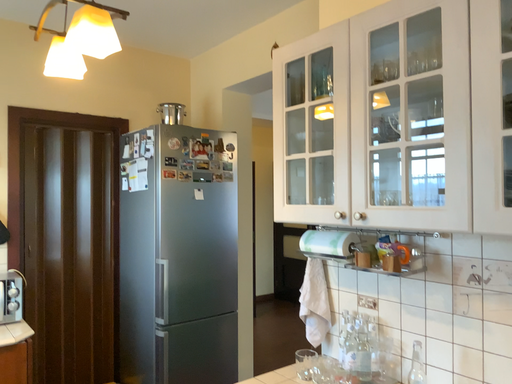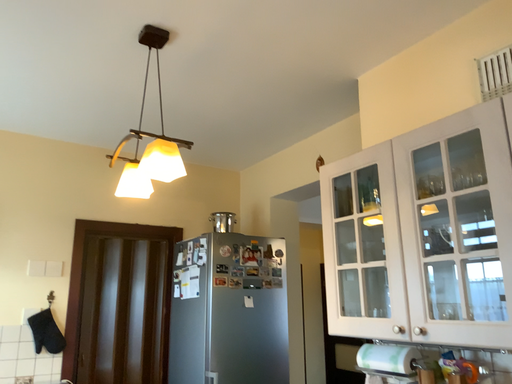
Question: How did the camera likely rotate when shooting the video?

Choices:
 (A) rotated upward
 (B) rotated downward

Answer: (A)